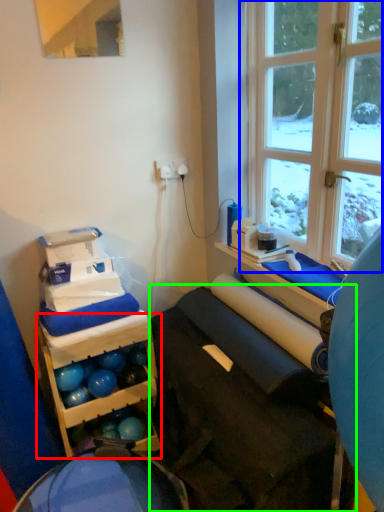
Question: Considering the real-world distances, which object is closest to shelf (highlighted by a red box)? window (highlighted by a blue box) or furniture (highlighted by a green box).

Choices:
 (A) window
 (B) furniture

Answer: (B)